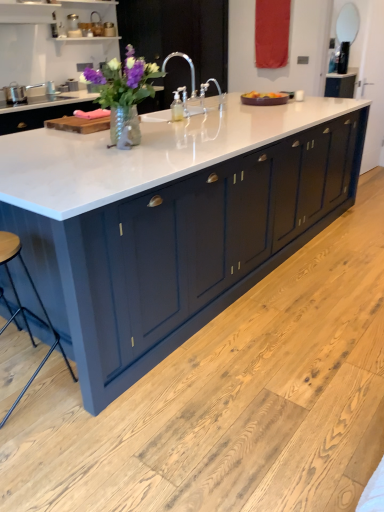
Find the location of `empty space that is ontop of white marble countertop at center (from a real-world perspective)`. empty space that is ontop of white marble countertop at center (from a real-world perspective) is located at coordinates (167, 125).